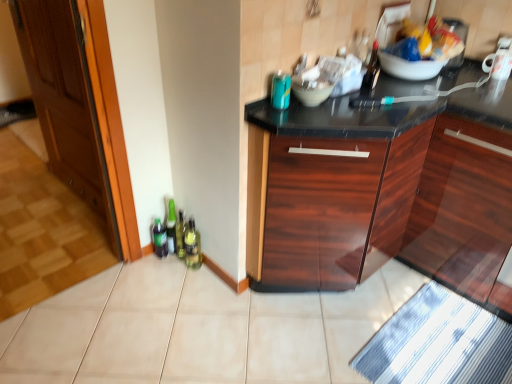
In order to click on vacant space in front of green glass bottle at lower left in this screenshot , I will do `click(186, 291)`.